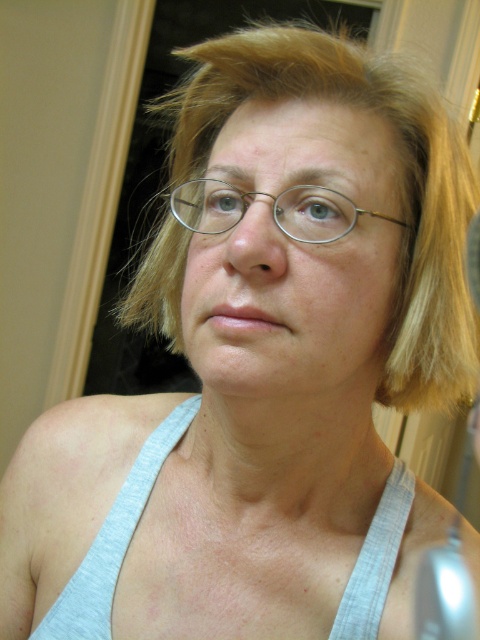
Which of these two, gray fabric vest at center or metallic wireframe glasses at center, stands taller?

Standing taller between the two is gray fabric vest at center.

In the scene shown: Can you confirm if gray fabric vest at center is taller than metallic wireframe glasses at center?

→ Yes.

Identify the location of gray fabric vest at center. (113, 540).

Does matte silver glasses at center have a smaller size compared to metallic wireframe glasses at center?

Incorrect, matte silver glasses at center is not smaller in size than metallic wireframe glasses at center.

Is matte silver glasses at center closer to camera compared to metallic wireframe glasses at center?

Yes.

Where is `matte silver glasses at center`? This screenshot has height=640, width=480. matte silver glasses at center is located at coordinates (294, 250).

Identify the location of matte silver glasses at center. The height and width of the screenshot is (640, 480). (294, 250).

Is point (242, 371) in front of point (393, 541)?

Yes, point (242, 371) is in front of point (393, 541).

Is point (349, 216) closer to viewer compared to point (146, 451)?

Yes.

Identify the location of matte silver glasses at center. This screenshot has width=480, height=640. (294, 250).